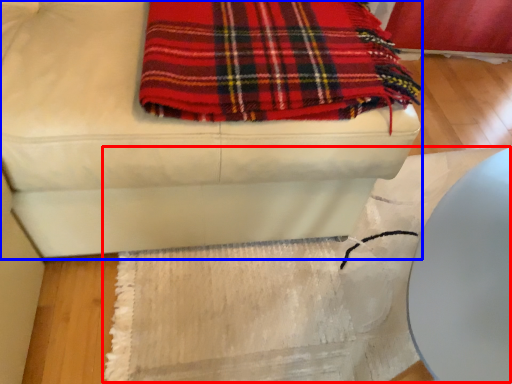
Question: Which point is closer to the camera, mat (highlighted by a red box) or furniture (highlighted by a blue box)?

Choices:
 (A) mat
 (B) furniture

Answer: (B)